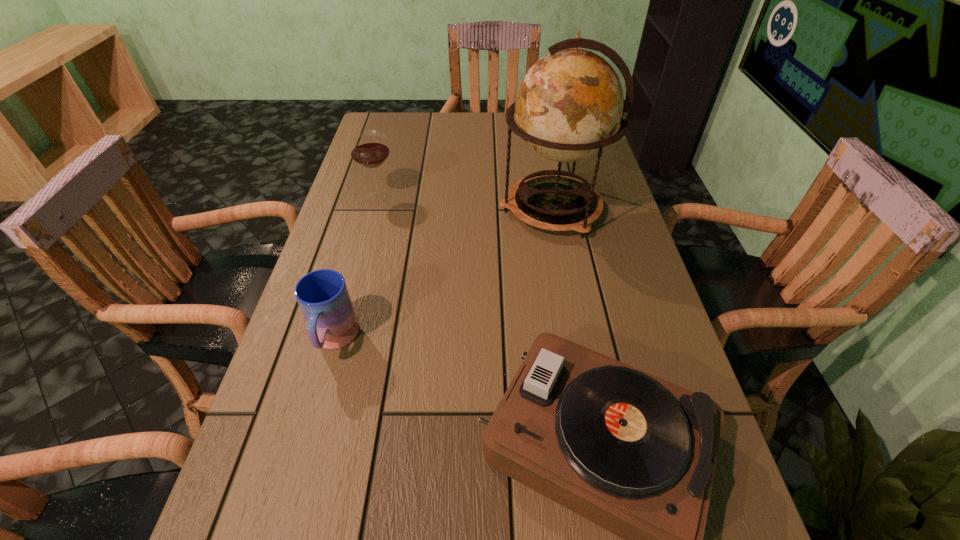
Where is `the tallest object`? The height and width of the screenshot is (540, 960). the tallest object is located at coordinates (568, 106).

Locate an element on the screen. The image size is (960, 540). the second tallest object is located at coordinates (369, 149).

Where is `mug`? mug is located at coordinates (322, 295).

The width and height of the screenshot is (960, 540). I want to click on free space located 0.060m at the center of the globe, so click(x=476, y=209).

Where is `vacant space located at the center of the globe`? vacant space located at the center of the globe is located at coordinates (388, 209).

Find the location of a particular element. free space located at the center of the globe is located at coordinates (385, 209).

Where is `vacant space positioned 0.100m on the right of the wineglass`? The width and height of the screenshot is (960, 540). vacant space positioned 0.100m on the right of the wineglass is located at coordinates (432, 197).

The width and height of the screenshot is (960, 540). What are the coordinates of `vacant region located on the side of the mug with the handle` in the screenshot? It's located at 315,409.

Locate an element on the screen. This screenshot has height=540, width=960. wineglass that is positioned at the left edge is located at coordinates (369, 149).

You are a GUI agent. You are given a task and a screenshot of the screen. Output one action in this format:
    pyautogui.click(x=<x>, y=<y>)
    Task: Click on the mug present at the left edge
    The image size is (960, 540).
    Given the screenshot: What is the action you would take?
    pyautogui.click(x=322, y=295)